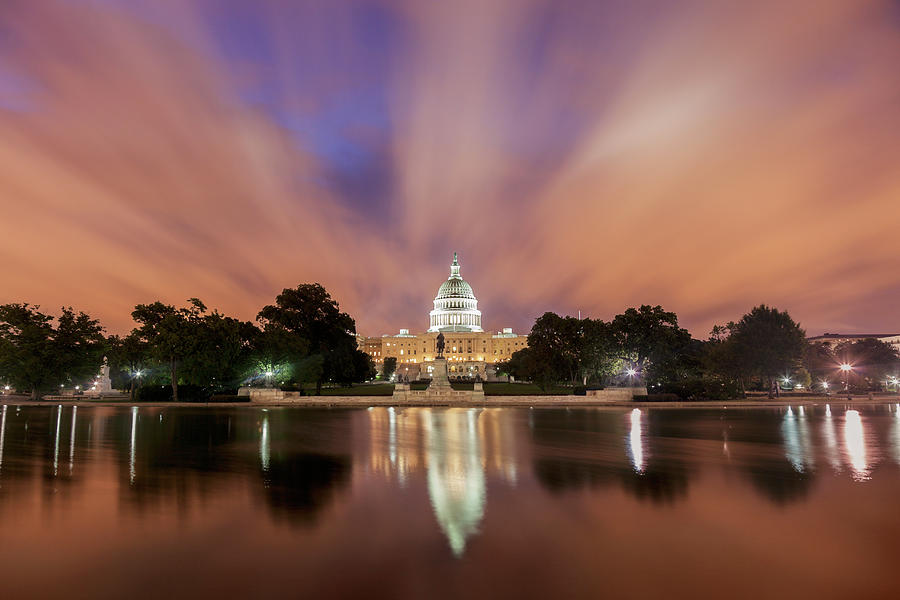
The height and width of the screenshot is (600, 900). Find the location of `light`. light is located at coordinates (632, 373).